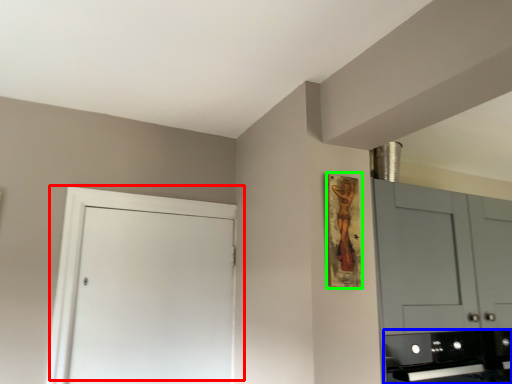
Question: Estimate the real-world distances between objects in this image. Which object is farther from door (highlighted by a red box), appliance (highlighted by a blue box) or picture frame (highlighted by a green box)?

Choices:
 (A) appliance
 (B) picture frame

Answer: (A)